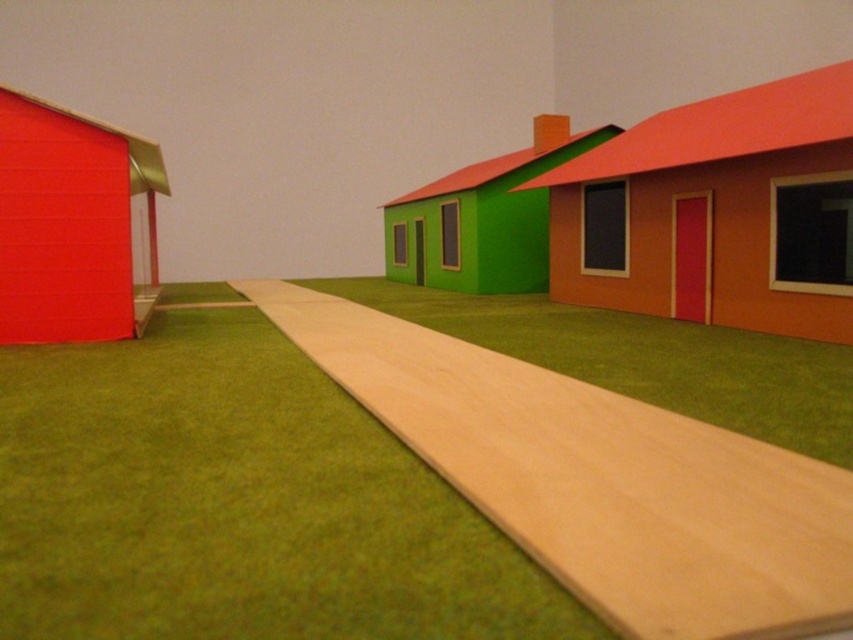
You are standing at the entrance of the miniature scene and want to walk to the green matte house at center. Is the smooth wooden path at center the correct path to take?

Yes, the smooth wooden path at center is in front of the green matte house at center, so it is the correct path to take.

You are standing at the end of the light brown pathway and want to reach the green matte house at center. Which direction should you walk to avoid the matte red hut at left?

Since the matte red hut at left is in front of the green matte house at center, you should walk around it to the right or left side of the matte red hut at left to reach the green matte house at center without obstruction.